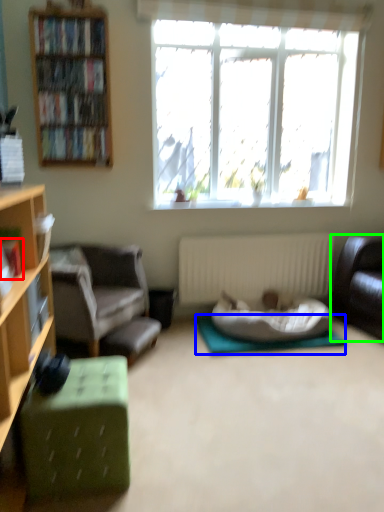
Question: Considering the real-world distances, which object is closest to book (highlighted by a red box)? yoga mat (highlighted by a blue box) or studio couch (highlighted by a green box).

Choices:
 (A) yoga mat
 (B) studio couch

Answer: (A)